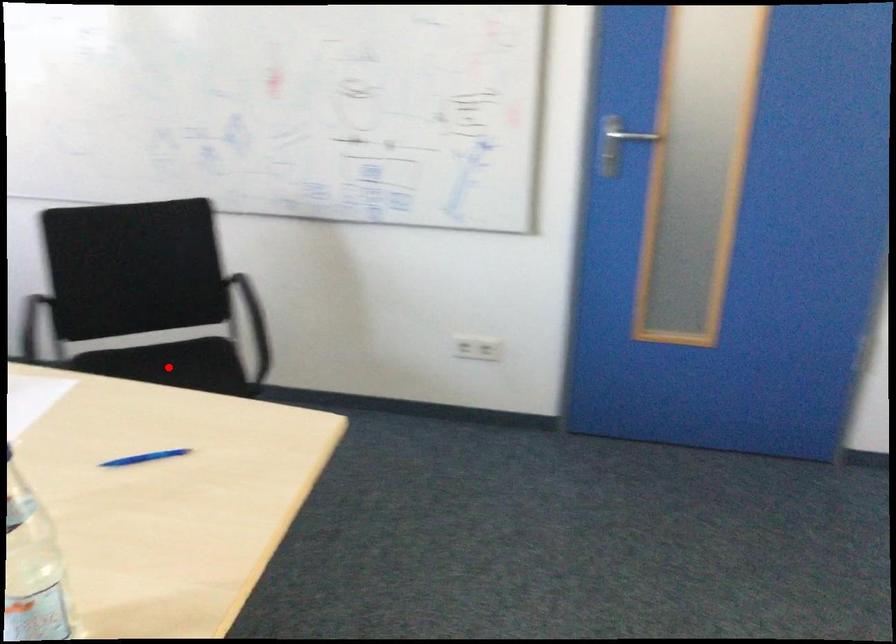
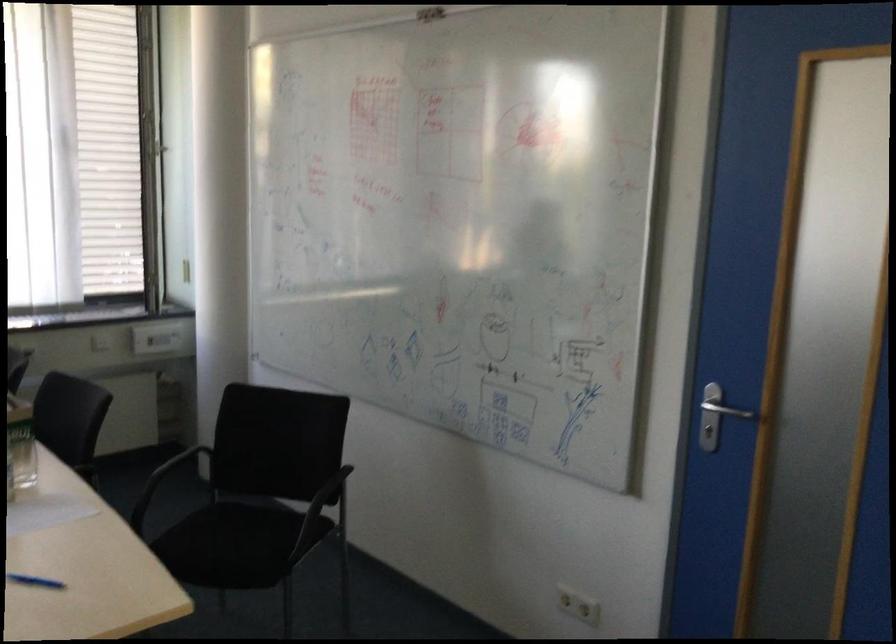
Where in the second image is the point corresponding to the highlighted location from the first image?

(251, 529)